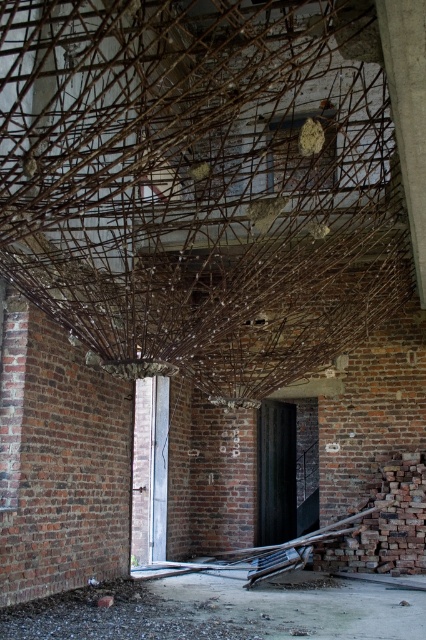
You are an inspector checking the structural integrity of this abandoned building. You notice a brown textured branch at center and a smooth concrete pillar at upper right. Which object is closer to the left side of the room?

The brown textured branch at center is positioned on the left side of the smooth concrete pillar at upper right, meaning it is closer to the left side of the room.

You are an inspector checking the structural integrity of this building. You notice the brown textured branch at center and the smooth concrete pillar at upper right. Which object is more likely to be a potential safety hazard based on their sizes?

A: The brown textured branch at center has a smaller size compared to the smooth concrete pillar at upper right, making it more likely to be a potential safety hazard due to its insufficient structural support.